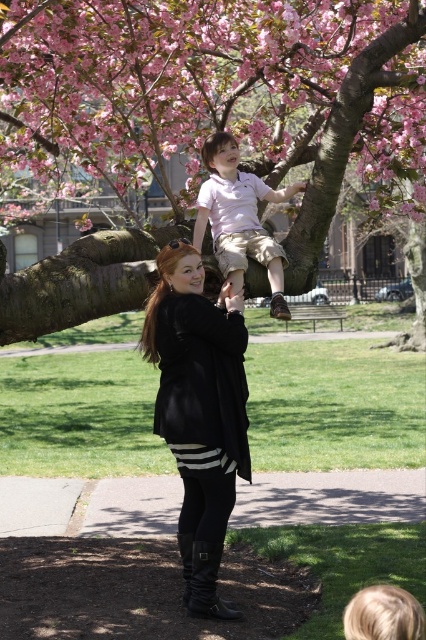
Question: Estimate the real-world distances between objects in this image. Which object is farther from the pink blossom tree at upper center?

Choices:
 (A) light pink cotton shirt at upper center
 (B) black leather boots at lower center

Answer: (B)

Question: Which point is farther from the camera taking this photo?

Choices:
 (A) (6, 83)
 (B) (250, 464)
 (C) (207, 220)

Answer: (A)

Question: Is pink blossom tree at upper center to the right of black leather boots at lower center from the viewer's perspective?

Choices:
 (A) no
 (B) yes

Answer: (B)

Question: Observing the image, what is the correct spatial positioning of pink blossom tree at upper center in reference to black leather boots at lower center?

Choices:
 (A) right
 (B) left

Answer: (A)

Question: Is pink blossom tree at upper center to the right of light pink cotton shirt at upper center from the viewer's perspective?

Choices:
 (A) yes
 (B) no

Answer: (B)

Question: Which object is closer to the camera taking this photo?

Choices:
 (A) light pink cotton shirt at upper center
 (B) black leather boots at lower center
 (C) pink blossom tree at upper center

Answer: (B)